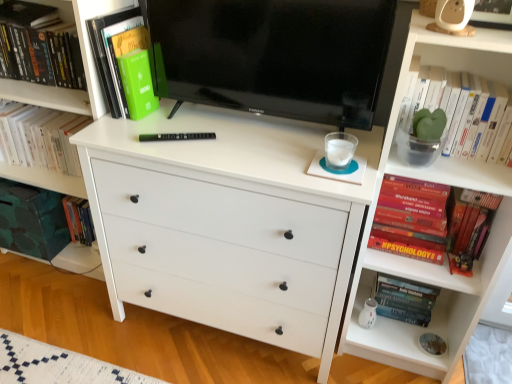
Question: Is point (421, 317) closer or farther from the camera than point (157, 67)?

Choices:
 (A) farther
 (B) closer

Answer: (A)

Question: From a real-world perspective, is hardcover psychology book at lower right, placed as the third book when sorted from right to left, positioned above or below black glossy tv at center?

Choices:
 (A) below
 (B) above

Answer: (A)

Question: Considering the real-world distances, which object is farthest from the beige plastic toy at upper right?

Choices:
 (A) white matte chest of drawers at center
 (B) green matte book at upper left, the first book positioned from the left
 (C) green matte plant at upper right, marked as the 5th book in a left-to-right arrangement
 (D) black glossy tv at center
 (E) green matte book at upper left, positioned as the 2th book in left-to-right order

Answer: (B)

Question: Which object is the closest to the hardcover psychology book at lower right, placed as the third book when sorted from right to left?

Choices:
 (A) green matte book at upper left, the first book positioned from the left
 (B) green matte book at upper left, positioned as the 2th book in left-to-right order
 (C) black glossy tv at center
 (D) white matte chest of drawers at center
 (E) green matte plant at upper right, marked as the 5th book in a left-to-right arrangement

Answer: (E)